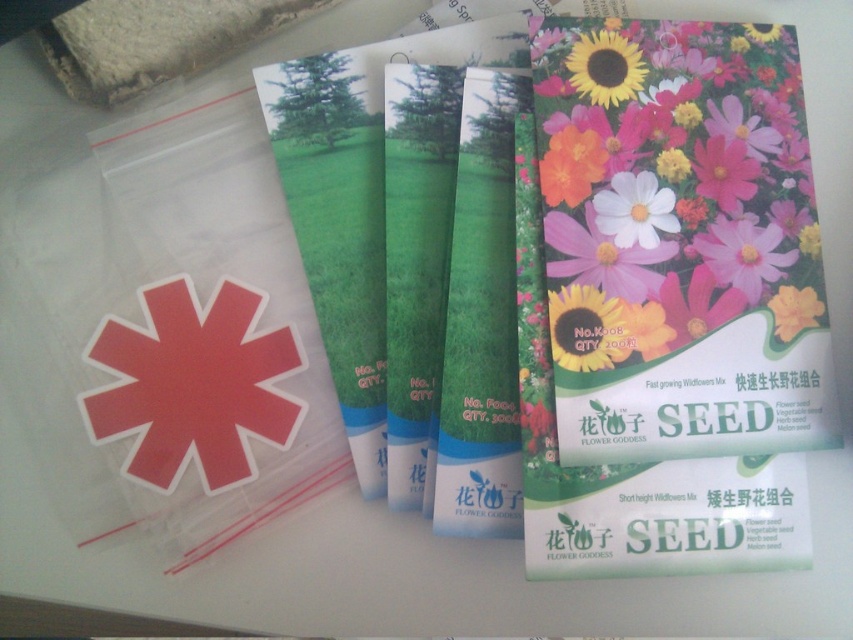
Question: Does green matte tube at center have a larger size compared to white matte flower at upper right?

Choices:
 (A) no
 (B) yes

Answer: (B)

Question: Which point is farther to the camera?

Choices:
 (A) (804, 314)
 (B) (630, 275)
 (C) (480, 387)
 (D) (647, 193)

Answer: (C)

Question: Which point is farther from the camera taking this photo?

Choices:
 (A) (560, 353)
 (B) (724, 138)

Answer: (B)

Question: Does yellow matte sunflower at upper right appear on the left side of yellow matte flower at upper right?

Choices:
 (A) yes
 (B) no

Answer: (A)

Question: Is green matte tube at center bigger than white matte flower at upper right?

Choices:
 (A) no
 (B) yes

Answer: (B)

Question: Which object is closer to the camera taking this photo?

Choices:
 (A) matte paper sunflower at right
 (B) white matte flower at upper right
 (C) yellow matte sunflower at upper right

Answer: (A)